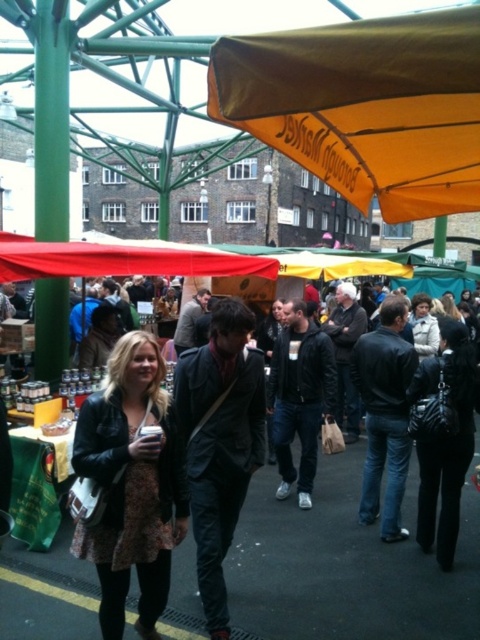
Which of these two, orange fabric canopy at upper center or leather jacket at center, stands shorter?

With less height is orange fabric canopy at upper center.

Which is behind, point (404, 218) or point (147, 589)?

Positioned behind is point (404, 218).

You are a GUI agent. You are given a task and a screenshot of the screen. Output one action in this format:
    pyautogui.click(x=<x>, y=<y>)
    Task: Click on the orange fabric canopy at upper center
    
    Given the screenshot: What is the action you would take?
    pyautogui.click(x=364, y=106)